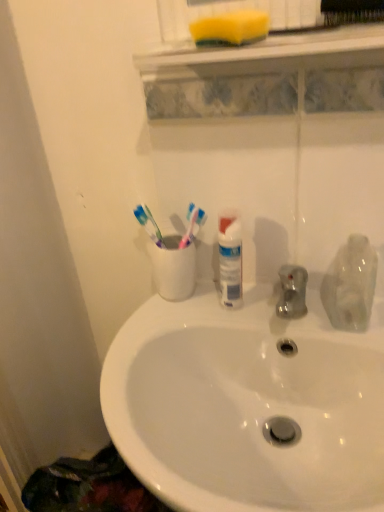
Identify the location of vacant region to the left of transparent plastic bottle at right. The width and height of the screenshot is (384, 512). pos(263,313).